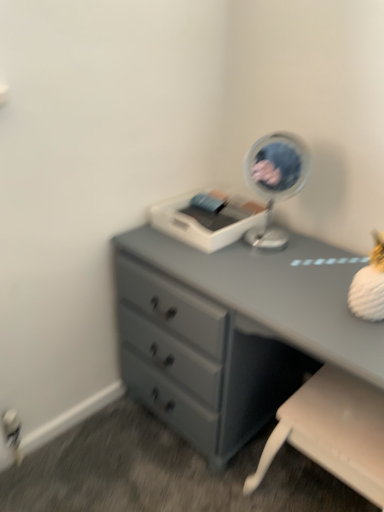
Locate an element on the screen. Image resolution: width=384 pixels, height=512 pixels. free point above matte gray dresser at center (from a real-world perspective) is located at coordinates (270, 267).